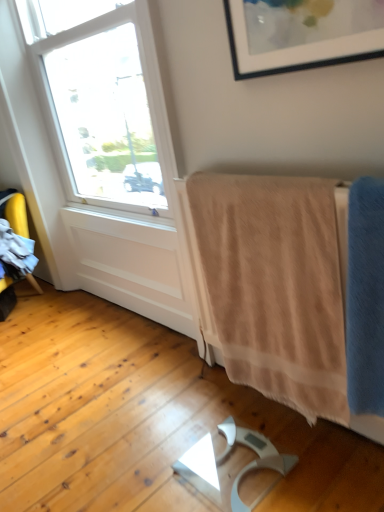
In the scene shown: Measure the distance between beige soft towel at lower right, which is the first bath towel from back to front, and camera.

beige soft towel at lower right, which is the first bath towel from back to front, and camera are 3.48 feet apart.

In the scene shown: What is the approximate height of beige soft towel at lower right, which is the first bath towel from back to front?

84.94 centimeters.

The image size is (384, 512). Describe the element at coordinates (275, 286) in the screenshot. I see `beige soft towel at lower right, the second bath towel when ordered from front to back` at that location.

Identify the location of beige soft towel at lower right, the second bath towel when ordered from front to back. The image size is (384, 512). (275, 286).

Image resolution: width=384 pixels, height=512 pixels. What do you see at coordinates (365, 297) in the screenshot?
I see `blue soft towel at right, acting as the second bath towel starting from the back` at bounding box center [365, 297].

What is the approximate height of blue soft towel at right, acting as the second bath towel starting from the back?

blue soft towel at right, acting as the second bath towel starting from the back, is 28.56 inches tall.

Where is `blue soft towel at right, acting as the second bath towel starting from the back`? The width and height of the screenshot is (384, 512). blue soft towel at right, acting as the second bath towel starting from the back is located at coordinates (365, 297).

Where is `beige soft towel at lower right, the second bath towel when ordered from front to back`? The height and width of the screenshot is (512, 384). beige soft towel at lower right, the second bath towel when ordered from front to back is located at coordinates (275, 286).

Can you confirm if beige soft towel at lower right, the second bath towel when ordered from front to back, is positioned to the left of blue soft towel at right, acting as the second bath towel starting from the back?

Indeed, beige soft towel at lower right, the second bath towel when ordered from front to back, is positioned on the left side of blue soft towel at right, acting as the second bath towel starting from the back.

Is beige soft towel at lower right, the second bath towel when ordered from front to back, further to the viewer compared to blue soft towel at right, acting as the second bath towel starting from the back?

Yes, beige soft towel at lower right, the second bath towel when ordered from front to back, is behind blue soft towel at right, acting as the second bath towel starting from the back.

Which is closer to the camera, (228, 346) or (362, 322)?

Point (362, 322)

From the image's perspective, between beige soft towel at lower right, the second bath towel when ordered from front to back, and blue soft towel at right, acting as the second bath towel starting from the back, who is located below?

blue soft towel at right, acting as the second bath towel starting from the back, appears lower in the image.

From a real-world perspective, does beige soft towel at lower right, the second bath towel when ordered from front to back, sit lower than blue soft towel at right, acting as the second bath towel starting from the back?

Correct, in the physical world, beige soft towel at lower right, the second bath towel when ordered from front to back, is lower than blue soft towel at right, acting as the second bath towel starting from the back.

Between beige soft towel at lower right, which is the first bath towel from back to front, and blue soft towel at right, arranged as the 1th bath towel when viewed from the front, which one has smaller width?

beige soft towel at lower right, which is the first bath towel from back to front, is thinner.

Between beige soft towel at lower right, which is the first bath towel from back to front, and blue soft towel at right, acting as the second bath towel starting from the back, which one has more height?

With more height is beige soft towel at lower right, which is the first bath towel from back to front.

Between beige soft towel at lower right, the second bath towel when ordered from front to back, and blue soft towel at right, arranged as the 1th bath towel when viewed from the front, which one has smaller size?

With smaller size is blue soft towel at right, arranged as the 1th bath towel when viewed from the front.

Is beige soft towel at lower right, which is the first bath towel from back to front, completely or partially outside of blue soft towel at right, arranged as the 1th bath towel when viewed from the front?

beige soft towel at lower right, which is the first bath towel from back to front, is positioned outside blue soft towel at right, arranged as the 1th bath towel when viewed from the front.

Would you say beige soft towel at lower right, which is the first bath towel from back to front, is a long distance from blue soft towel at right, acting as the second bath towel starting from the back?

No, there isn't a large distance between beige soft towel at lower right, which is the first bath towel from back to front, and blue soft towel at right, acting as the second bath towel starting from the back.

Is beige soft towel at lower right, the second bath towel when ordered from front to back, looking in the opposite direction of blue soft towel at right, arranged as the 1th bath towel when viewed from the front?

beige soft towel at lower right, the second bath towel when ordered from front to back, does not have its back to blue soft towel at right, arranged as the 1th bath towel when viewed from the front.

I want to click on bath towel below the beige soft towel at lower right, which is the first bath towel from back to front (from the image's perspective), so click(x=365, y=297).

Can you confirm if blue soft towel at right, acting as the second bath towel starting from the back, is positioned to the left of beige soft towel at lower right, which is the first bath towel from back to front?

No.

Is blue soft towel at right, acting as the second bath towel starting from the back, in front of or behind beige soft towel at lower right, which is the first bath towel from back to front, in the image?

Visually, blue soft towel at right, acting as the second bath towel starting from the back, is located in front of beige soft towel at lower right, which is the first bath towel from back to front.

Which point is more forward, (365, 387) or (268, 310)?

The point (365, 387) is more forward.

From the image's perspective, which is above, blue soft towel at right, acting as the second bath towel starting from the back, or beige soft towel at lower right, the second bath towel when ordered from front to back?

beige soft towel at lower right, the second bath towel when ordered from front to back, is shown above in the image.

From a real-world perspective, which object rests below the other?

From a 3D spatial view, beige soft towel at lower right, which is the first bath towel from back to front, is below.

Between blue soft towel at right, acting as the second bath towel starting from the back, and beige soft towel at lower right, which is the first bath towel from back to front, which one has larger width?

blue soft towel at right, acting as the second bath towel starting from the back, is wider.

Considering the sizes of objects blue soft towel at right, arranged as the 1th bath towel when viewed from the front, and beige soft towel at lower right, which is the first bath towel from back to front, in the image provided, who is taller, blue soft towel at right, arranged as the 1th bath towel when viewed from the front, or beige soft towel at lower right, which is the first bath towel from back to front,?

Standing taller between the two is beige soft towel at lower right, which is the first bath towel from back to front.

In the scene shown: Considering the sizes of objects blue soft towel at right, arranged as the 1th bath towel when viewed from the front, and beige soft towel at lower right, the second bath towel when ordered from front to back, in the image provided, who is bigger, blue soft towel at right, arranged as the 1th bath towel when viewed from the front, or beige soft towel at lower right, the second bath towel when ordered from front to back,?

beige soft towel at lower right, the second bath towel when ordered from front to back, is bigger.

Is blue soft towel at right, acting as the second bath towel starting from the back, not inside beige soft towel at lower right, which is the first bath towel from back to front?

Absolutely, blue soft towel at right, acting as the second bath towel starting from the back, is external to beige soft towel at lower right, which is the first bath towel from back to front.

Based on the photo, is blue soft towel at right, acting as the second bath towel starting from the back, with beige soft towel at lower right, which is the first bath towel from back to front?

No.

Is blue soft towel at right, acting as the second bath towel starting from the back, facing away from beige soft towel at lower right, the second bath towel when ordered from front to back?

No, beige soft towel at lower right, the second bath towel when ordered from front to back, is not at the back of blue soft towel at right, acting as the second bath towel starting from the back.

How many degrees apart are the facing directions of blue soft towel at right, arranged as the 1th bath towel when viewed from the front, and beige soft towel at lower right, the second bath towel when ordered from front to back?

They differ by 0.252 degrees in their facing directions.

Could you measure the distance between blue soft towel at right, arranged as the 1th bath towel when viewed from the front, and beige soft towel at lower right, the second bath towel when ordered from front to back?

The distance of blue soft towel at right, arranged as the 1th bath towel when viewed from the front, from beige soft towel at lower right, the second bath towel when ordered from front to back, is 9.40 inches.

You are a GUI agent. You are given a task and a screenshot of the screen. Output one action in this format:
    pyautogui.click(x=<x>, y=<y>)
    Task: Click on the bath towel below the beige soft towel at lower right, the second bath towel when ordered from front to back (from the image's perspective)
    
    Given the screenshot: What is the action you would take?
    pyautogui.click(x=365, y=297)

Where is `bath towel on the right of beige soft towel at lower right, which is the first bath towel from back to front`? The height and width of the screenshot is (512, 384). bath towel on the right of beige soft towel at lower right, which is the first bath towel from back to front is located at coordinates (365, 297).

The image size is (384, 512). In the image, there is a beige soft towel at lower right, which is the first bath towel from back to front. What are the coordinates of `bath towel below it (from the image's perspective)` in the screenshot? It's located at (365, 297).